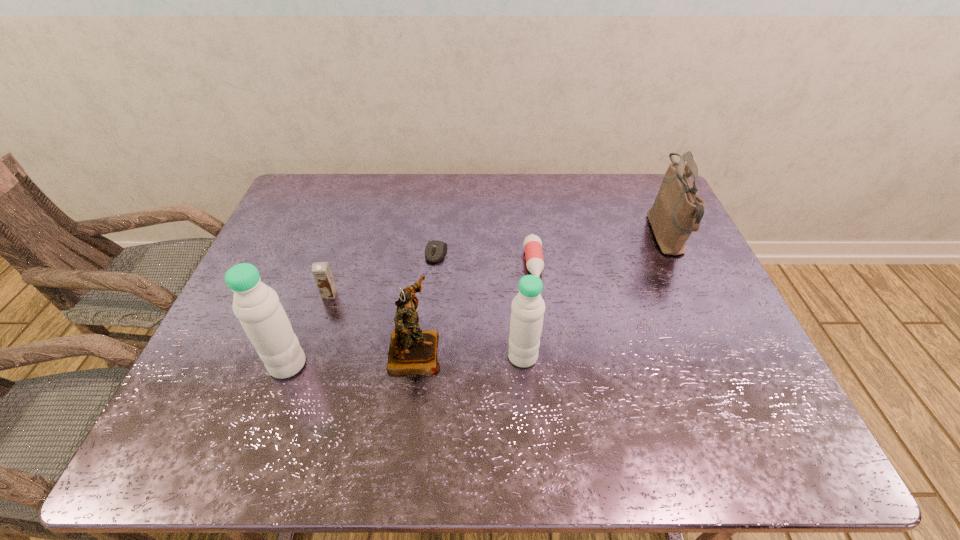
Where is `vacant space in between the rightmost object and the shortest object`? vacant space in between the rightmost object and the shortest object is located at coordinates (551, 245).

Where is `empty location between the figurine and the bottle`? Image resolution: width=960 pixels, height=540 pixels. empty location between the figurine and the bottle is located at coordinates (474, 308).

Where is `vacant area between the rightmost object and the taller water bottle`? The height and width of the screenshot is (540, 960). vacant area between the rightmost object and the taller water bottle is located at coordinates (477, 300).

This screenshot has width=960, height=540. I want to click on free space between the shortest object and the figurine, so click(425, 302).

The image size is (960, 540). What are the coordinates of `free point between the chocolate milk and the shortest object` in the screenshot? It's located at (383, 274).

Identify the location of vacant region between the figurine and the sixth tallest object. (474, 308).

Identify the location of free area in between the bottle and the shoulder bag. (600, 251).

Where is `free space between the right water bottle and the figurine`? Image resolution: width=960 pixels, height=540 pixels. free space between the right water bottle and the figurine is located at coordinates (468, 354).

Locate an element on the screen. This screenshot has width=960, height=540. vacant space in between the figurine and the shortest object is located at coordinates (425, 302).

Where is `object that can be found as the fourth closest to the bottle`? This screenshot has width=960, height=540. object that can be found as the fourth closest to the bottle is located at coordinates (677, 211).